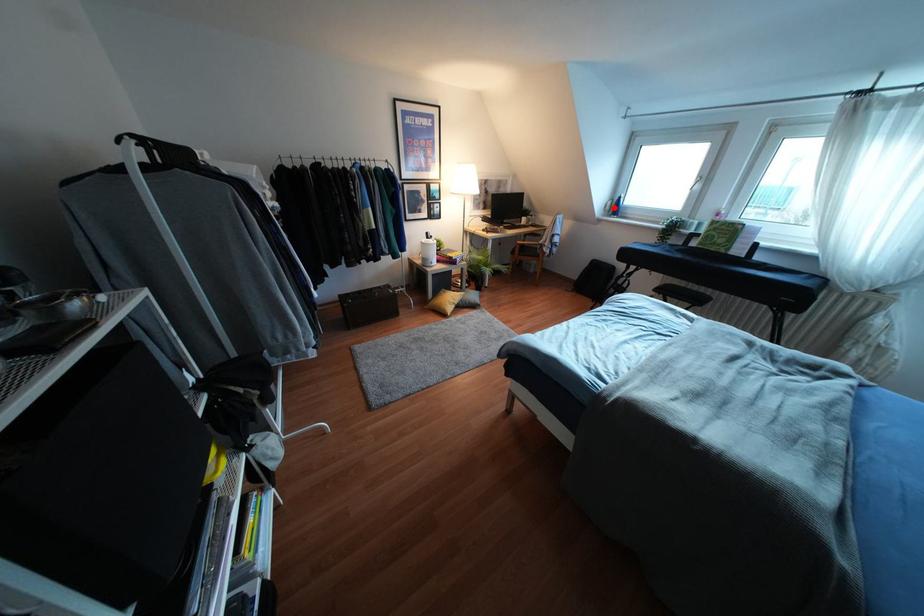
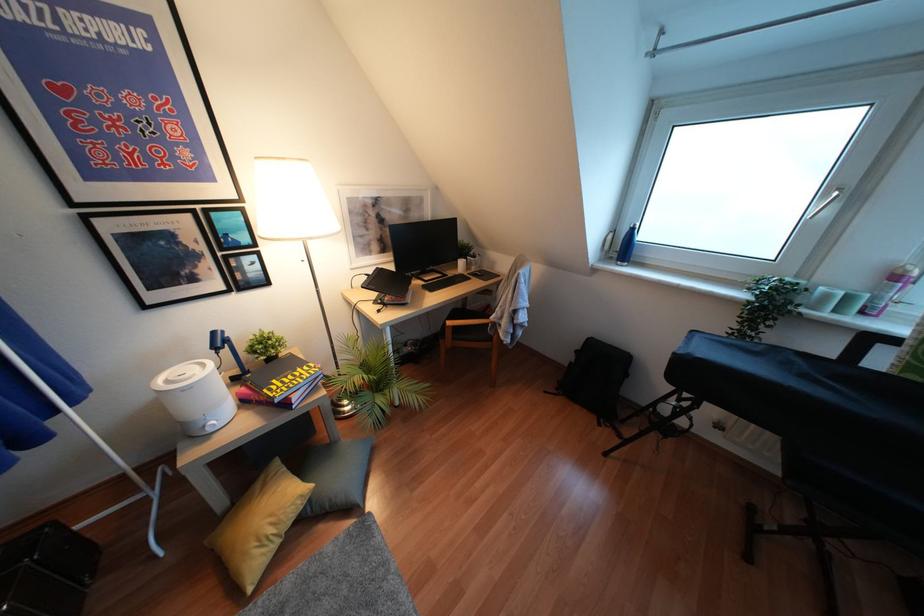
Question: I am providing you with two images of the same scene from different viewpoints. Given a red point in image1, look at the same physical point in image2. Is it:

Choices:
 (A) Closer to the viewpoint
 (B) Farther from the viewpoint

Answer: (B)